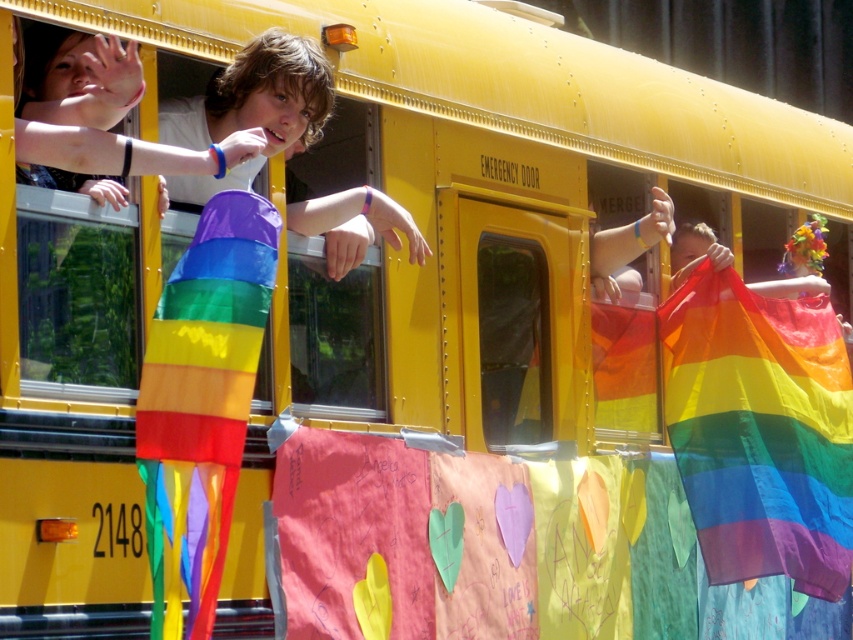
Is point (756, 520) behind point (242, 250)?

Yes, point (756, 520) is farther from viewer.

Based on the photo, is rainbow fabric flag at center below rainbow fabric flag at left?

Indeed, rainbow fabric flag at center is positioned under rainbow fabric flag at left.

Who is more distant from viewer, (704, 333) or (155, 572)?

Point (704, 333)

The width and height of the screenshot is (853, 640). I want to click on rainbow fabric flag at center, so click(x=759, y=429).